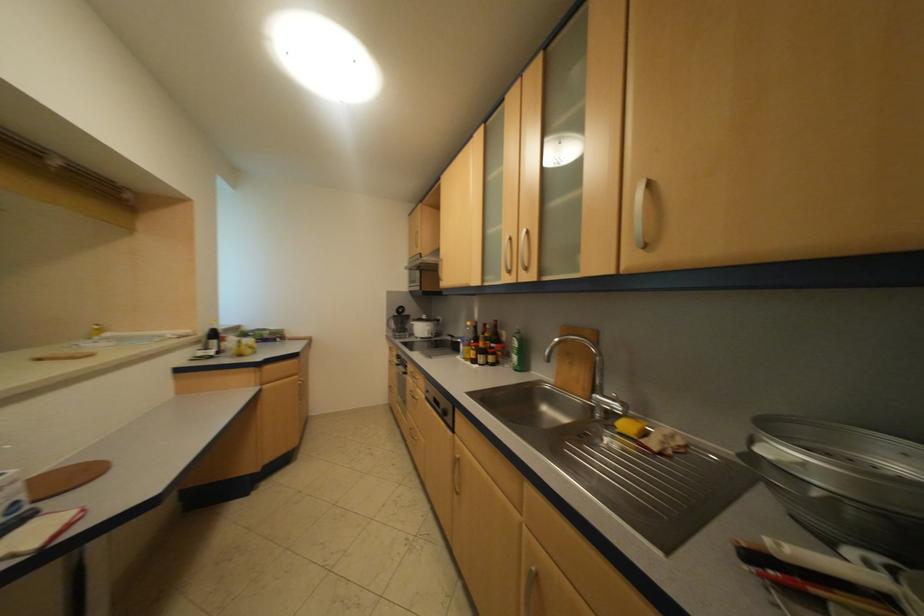
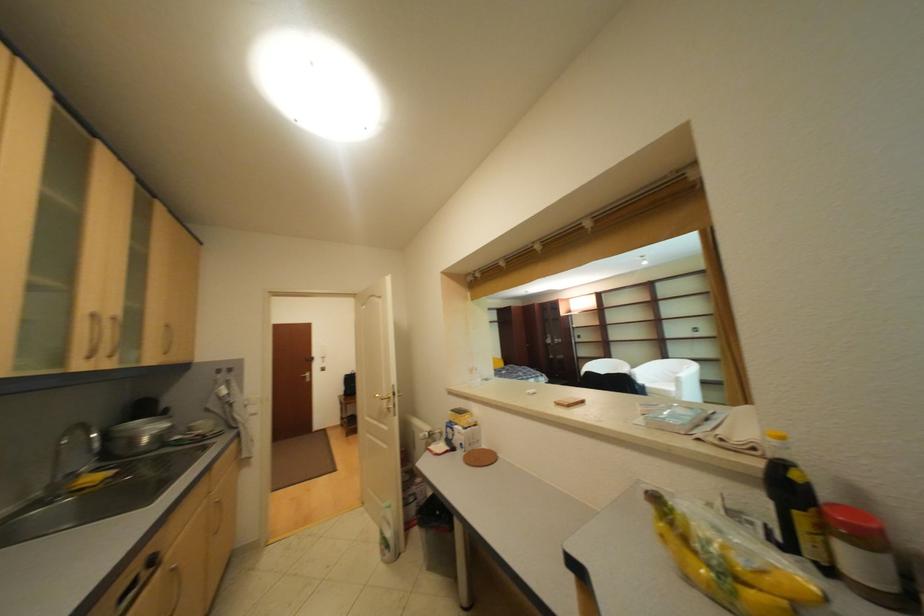
Where in the second image is the point corresponding to [469,458] from the first image?

(186, 567)